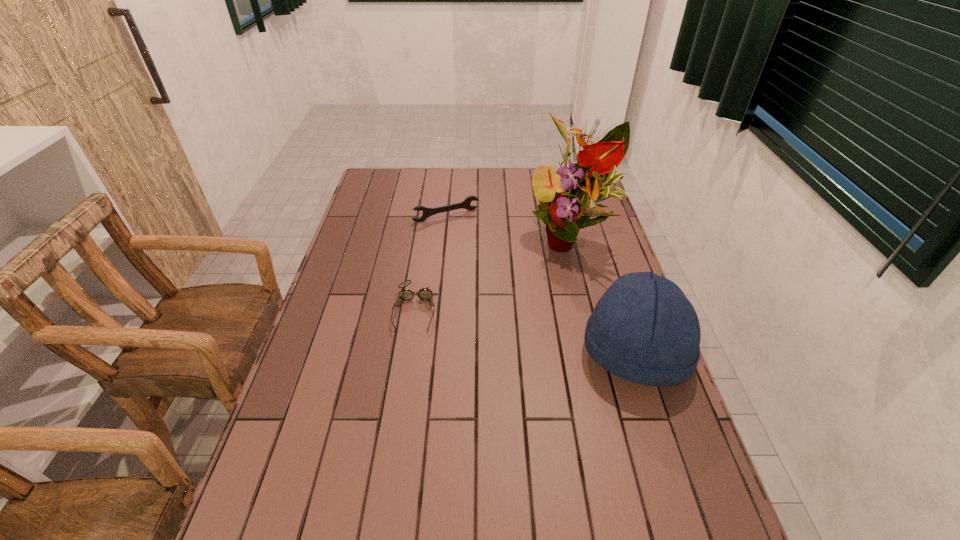
At what (x,y) coordinates should I click in order to perform the action: click on spectacles. Please return your answer as a coordinate pair (x, y). This screenshot has height=540, width=960. Looking at the image, I should click on (425, 294).

Locate an element on the screen. The image size is (960, 540). skullcap is located at coordinates (643, 329).

Find the location of `bouquet`. bouquet is located at coordinates (568, 195).

At what (x,y) coordinates should I click in order to perform the action: click on wrench. Please return your answer as a coordinate pair (x, y). Looking at the image, I should click on (427, 212).

Where is `vacant area situated 0.220m on the front-facing side of the shortest object`? vacant area situated 0.220m on the front-facing side of the shortest object is located at coordinates (401, 402).

Locate an element on the screen. vacant region located on the back of the skullcap is located at coordinates (606, 266).

Find the location of `free point located 0.400m on the front-facing side of the bouquet`. free point located 0.400m on the front-facing side of the bouquet is located at coordinates (540, 375).

This screenshot has height=540, width=960. Find the location of `free space located 0.400m on the front-facing side of the bouquet`. free space located 0.400m on the front-facing side of the bouquet is located at coordinates (540, 375).

Where is `free space located 0.370m on the front-facing side of the bouquet`? This screenshot has height=540, width=960. free space located 0.370m on the front-facing side of the bouquet is located at coordinates (541, 366).

Where is `free space located on the open ends of the wrench`? This screenshot has height=540, width=960. free space located on the open ends of the wrench is located at coordinates (468, 239).